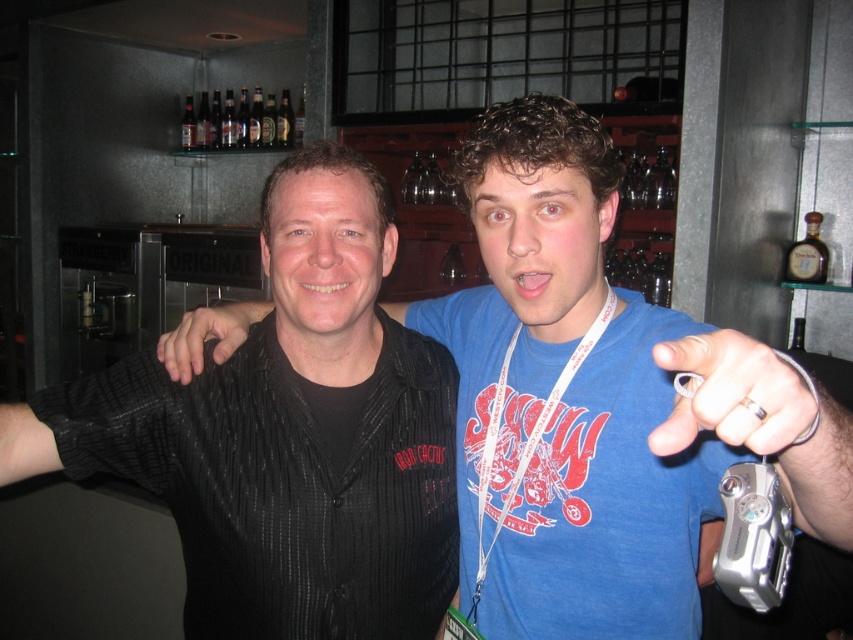
Image resolution: width=853 pixels, height=640 pixels. Identify the location of black matte hand at center. (206, 337).

Who is lower down, black matte hand at center or clear glass bottles at upper center?

Positioned lower is black matte hand at center.

Which is in front, point (172, 340) or point (244, 128)?

Point (172, 340) is more forward.

The image size is (853, 640). Find the location of `black matte hand at center`. black matte hand at center is located at coordinates (206, 337).

Who is taller, black ribbed shirt at center or black matte hand at center?

black ribbed shirt at center is taller.

Who is more distant from viewer, (254, 358) or (221, 332)?

Point (221, 332)

Identify the location of black ribbed shirt at center. The width and height of the screenshot is (853, 640). (287, 435).

Who is shorter, black textured shirt at center or black matte hand at center?

With less height is black matte hand at center.

Is black textured shirt at center below black matte hand at center?

Indeed, black textured shirt at center is positioned under black matte hand at center.

Is point (509, 624) closer to camera compared to point (218, 324)?

Yes, point (509, 624) is in front of point (218, 324).

Find the location of a particular element. black textured shirt at center is located at coordinates (601, 403).